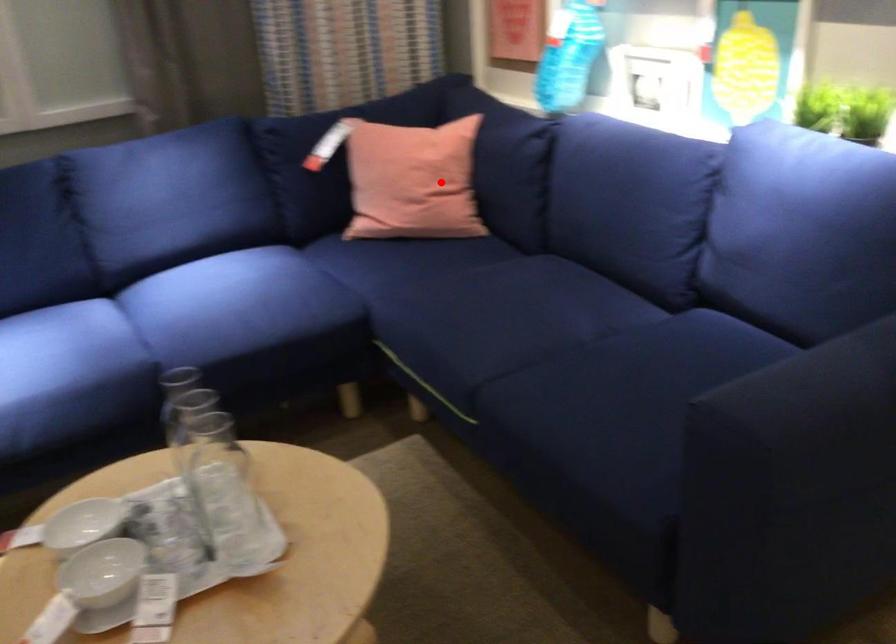
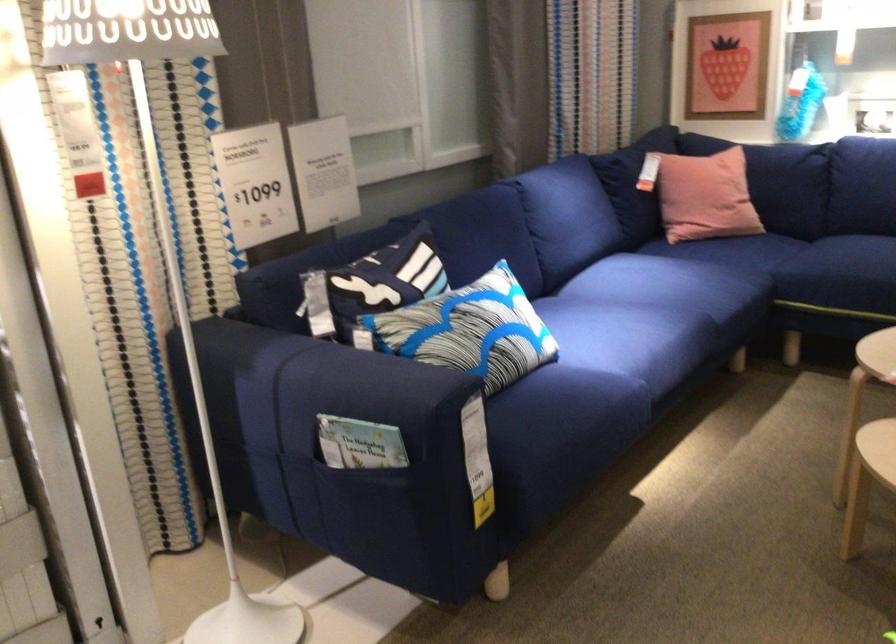
Find the pixel in the second image that matches the highlighted location in the first image.

(759, 176)